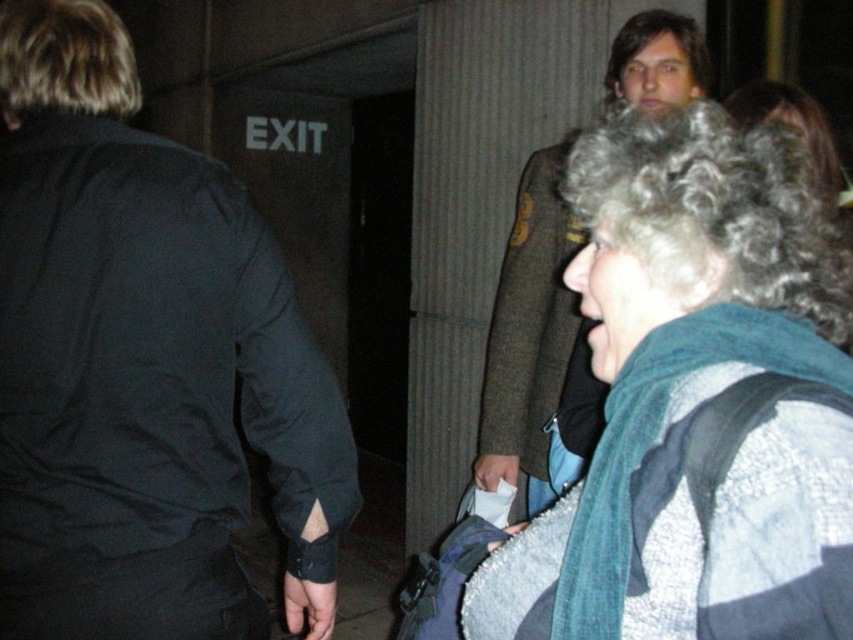
You are an event organizer trying to arrange seating for a small gathering in this area. Given the space taken up by the black matte jacket at upper left and the green wool coat at upper right, which of the two would require more space to accommodate comfortably?

The green wool coat at upper right requires more space because it occupies more area than the black matte jacket at upper left.

You are at a venue and need to locate the exit door. You see the gray wool scarf at upper right and the green wool coat at upper right. Which object is nearer to you?

The gray wool scarf at upper right is closer to the viewer than the green wool coat at upper right.

From the picture: You are standing in the scene and want to move from the point at coordinates point [19,422] to the point at coordinates point [541,195]. Which direction should you face to move towards the farther point?

You should face away from the camera because point [541,195] is farther from the camera compared to point [19,422].